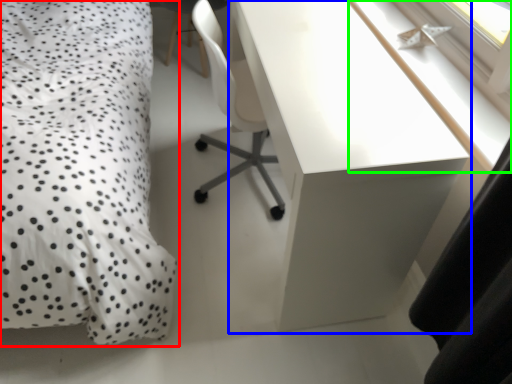
Question: Based on their relative distances, which object is farther from bed (highlighted by a red box)? Choose from desk (highlighted by a blue box) and window sill (highlighted by a green box).

Choices:
 (A) desk
 (B) window sill

Answer: (B)